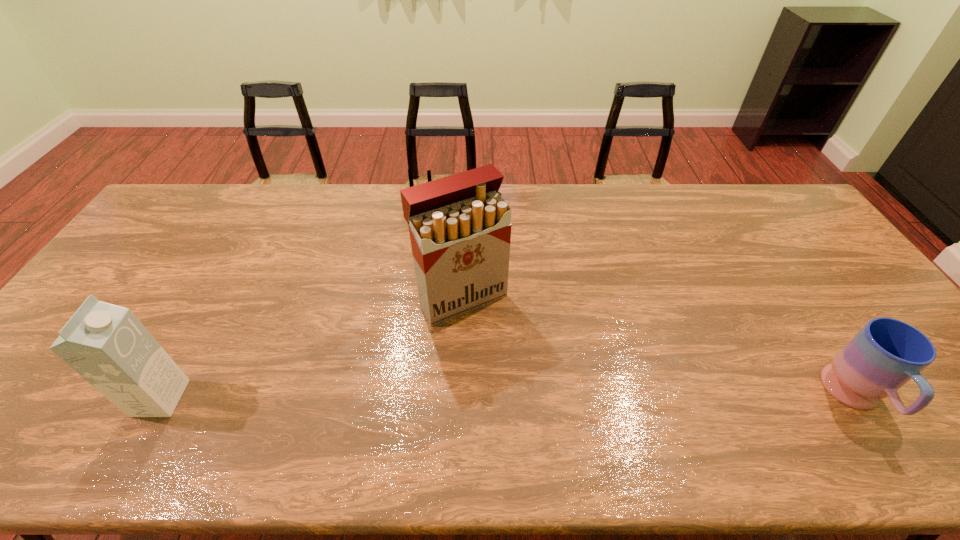
Where is `free space located with the lid open on the tallest object`? The height and width of the screenshot is (540, 960). free space located with the lid open on the tallest object is located at coordinates (543, 412).

The image size is (960, 540). I want to click on vacant region located with the lid open on the tallest object, so click(x=508, y=360).

You are a GUI agent. You are given a task and a screenshot of the screen. Output one action in this format:
    pyautogui.click(x=<x>, y=<y>)
    Task: Click on the free space located with the lid open on the tallest object
    This screenshot has height=540, width=960.
    Given the screenshot: What is the action you would take?
    pyautogui.click(x=534, y=398)

Locate an element on the screen. Image resolution: width=960 pixels, height=540 pixels. object at the far edge is located at coordinates (410, 176).

Locate an element on the screen. carton that is at the near edge is located at coordinates (106, 344).

Where is `mug present at the near edge`? mug present at the near edge is located at coordinates (886, 353).

In the image, there is a desktop. Where is `free region at the far edge`? The image size is (960, 540). free region at the far edge is located at coordinates (657, 201).

The image size is (960, 540). I want to click on blank space at the near edge of the desktop, so click(x=374, y=393).

The image size is (960, 540). Find the location of `free region at the left edge of the desktop`. free region at the left edge of the desktop is located at coordinates (66, 372).

What are the coordinates of `free space at the far left corner of the desktop` in the screenshot? It's located at (x=202, y=217).